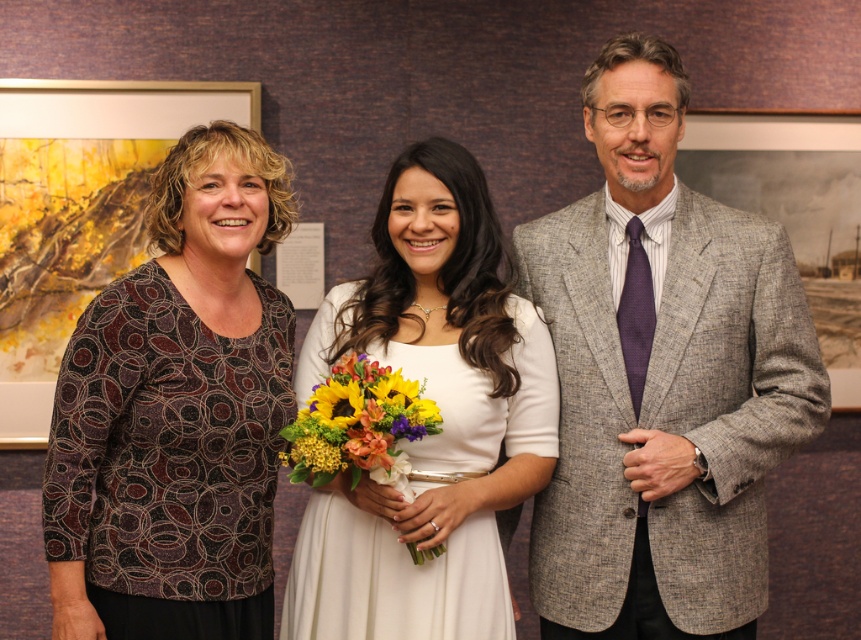
Is patterned fabric blouse at left closer to the viewer compared to white satin dress at center?

That is True.

This screenshot has height=640, width=861. I want to click on patterned fabric blouse at left, so click(177, 412).

You are a GUI agent. You are given a task and a screenshot of the screen. Output one action in this format:
    pyautogui.click(x=<x>, y=<y>)
    Task: Click on the patterned fabric blouse at left
    The height and width of the screenshot is (640, 861).
    Given the screenshot: What is the action you would take?
    pyautogui.click(x=177, y=412)

Based on the photo, is patterned fabric blouse at left in front of sunflower bouquet at center?

No, it is not.

Is patterned fabric blouse at left positioned at the back of sunflower bouquet at center?

Yes.

Is point (254, 554) behind point (313, 417)?

Yes.

Find the location of a particular element. Image resolution: width=861 pixels, height=640 pixels. patterned fabric blouse at left is located at coordinates (177, 412).

Looking at this image, can you confirm if gray wool suit at right is taller than white satin dress at center?

Correct, gray wool suit at right is much taller as white satin dress at center.

Between gray wool suit at right and white satin dress at center, which one has less height?

Standing shorter between the two is white satin dress at center.

Identify the location of gray wool suit at right. (661, 378).